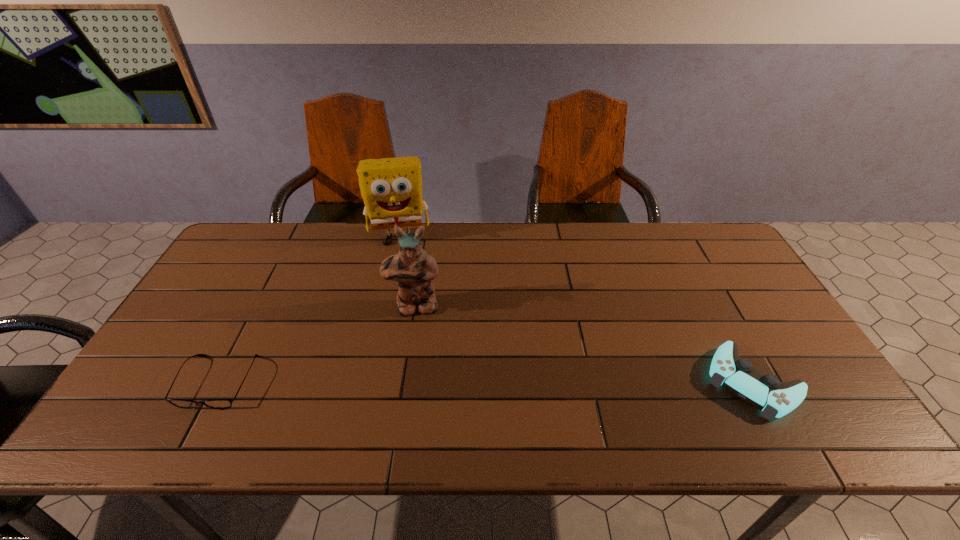
Locate an element on the screen. free space located 0.370m on the face of the sponge is located at coordinates (407, 338).

Identify the location of vacant area located 0.400m on the face of the sponge. The image size is (960, 540). (408, 347).

This screenshot has height=540, width=960. Find the location of `free space located on the face of the sponge`. free space located on the face of the sponge is located at coordinates (x=404, y=283).

Image resolution: width=960 pixels, height=540 pixels. I want to click on object that is positioned at the far edge, so click(x=391, y=188).

The width and height of the screenshot is (960, 540). I want to click on spectacles located in the near edge section of the desktop, so click(180, 403).

You are a GUI agent. You are given a task and a screenshot of the screen. Output one action in this format:
    pyautogui.click(x=<x>, y=<y>)
    Task: Click on the control that is at the near edge
    The height and width of the screenshot is (540, 960).
    Given the screenshot: What is the action you would take?
    pyautogui.click(x=765, y=392)

The height and width of the screenshot is (540, 960). I want to click on object located at the left edge, so click(180, 403).

Identify the location of object positioned at the right edge. The height and width of the screenshot is (540, 960). (765, 392).

At what (x,y) coordinates should I click in order to perform the action: click on object located at the near left corner. Please return your answer as a coordinate pair (x, y). Looking at the image, I should click on (180, 403).

This screenshot has width=960, height=540. In order to click on object situated at the near right corner in this screenshot , I will do `click(765, 392)`.